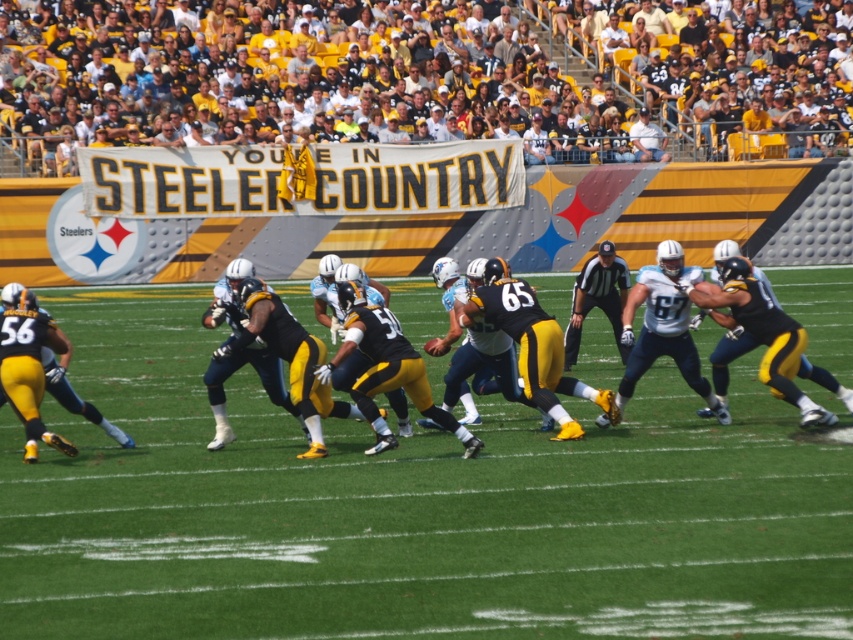
Based on the scene described, where is the point located at coordinates (x=409, y=509)?

The point at coordinates (x=409, y=509) is located on the green grass at center.

What is the 2D coordinate of the green grass at center?

The 2D coordinate of the green grass at center is at point (409, 509).

You are a fan watching the game from the stands. You notice the green grass at center and the black matte jersey at center. Which object is closer to you?

The green grass at center is closer to you because it is in front of the black matte jersey at center.